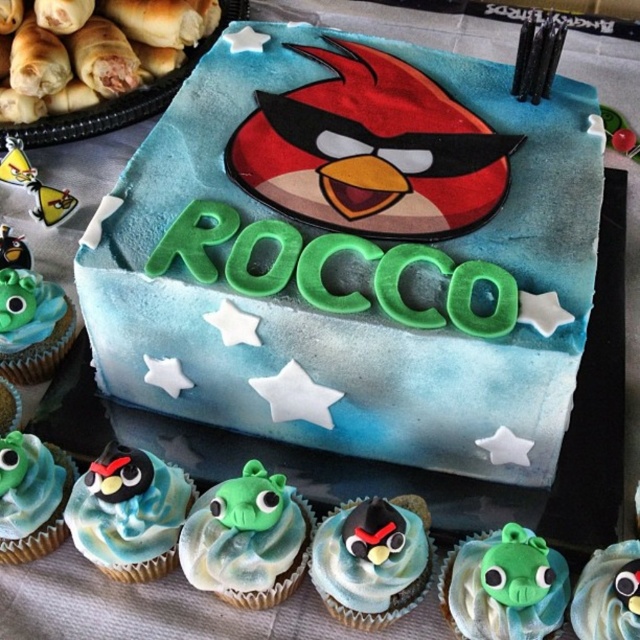
Question: Does green fondant angry bird at center have a smaller size compared to matte green fondant angry bird at lower right?

Choices:
 (A) yes
 (B) no

Answer: (B)

Question: Which is farther from the matte blue frosting at center?

Choices:
 (A) matte green fondant angry bird at lower left
 (B) green matte fondant cupcake at lower right
 (C) green fondant angry bird at center

Answer: (A)

Question: Is matte blue frosting at lower left above green fondant cupcake at lower left?

Choices:
 (A) yes
 (B) no

Answer: (B)

Question: Is blue fondant cake at center behind matte green fondant angry bird at lower right?

Choices:
 (A) no
 (B) yes

Answer: (B)

Question: Which point appears closest to the camera in this image?

Choices:
 (A) [4, 316]
 (B) [518, 588]
 (C) [40, 124]

Answer: (B)

Question: Which of these objects is positioned closest to the green matte fondant cupcake at lower right?

Choices:
 (A) green fondant cupcake at lower left
 (B) matte green fondant angry bird at lower right
 (C) matte blue frosting at lower left

Answer: (B)